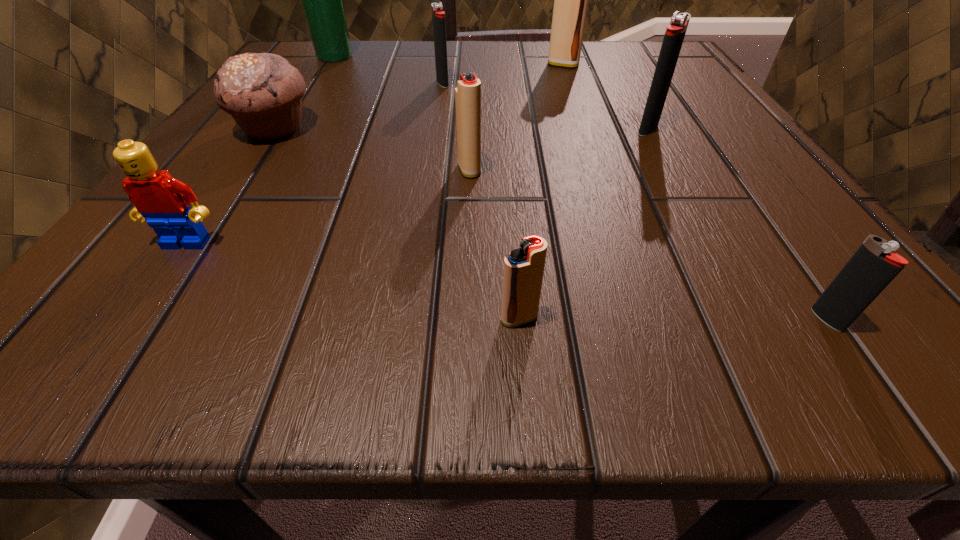
The image size is (960, 540). What are the coordinates of `object present at the far left corner` in the screenshot? It's located at (322, 0).

This screenshot has width=960, height=540. Identify the location of object located in the near right corner section of the desktop. (868, 272).

At what (x,y) coordinates should I click in order to perform the action: click on vacant space at the far edge. Please return your answer as a coordinate pair (x, y). The height and width of the screenshot is (540, 960). Looking at the image, I should click on (527, 69).

At what (x,y) coordinates should I click in order to perform the action: click on free space at the near edge. Please return your answer as a coordinate pair (x, y). The image size is (960, 540). Looking at the image, I should click on (725, 358).

Locate an element on the screen. The image size is (960, 540). free space at the left edge is located at coordinates (152, 253).

Locate an element on the screen. The height and width of the screenshot is (540, 960). free region at the right edge of the desktop is located at coordinates tap(720, 110).

Find the location of a particular element. The width and height of the screenshot is (960, 540). vacant region at the near left corner of the desktop is located at coordinates (245, 299).

At what (x,y) coordinates should I click in order to perform the action: click on vacant space at the far right corner of the desktop. Please return your answer as a coordinate pair (x, y). Image resolution: width=960 pixels, height=540 pixels. Looking at the image, I should click on (641, 82).

You are a GUI agent. You are given a task and a screenshot of the screen. Output one action in this format:
    pyautogui.click(x=<x>, y=<y>)
    Task: Click on the vacant area between the second farthest black igniter and the third nearest igniter
    The image size is (960, 540).
    Given the screenshot: What is the action you would take?
    pyautogui.click(x=559, y=150)

Where is `free space between the fourth igniter from right to left and the fifth igniter from left to right`? free space between the fourth igniter from right to left and the fifth igniter from left to right is located at coordinates (584, 224).